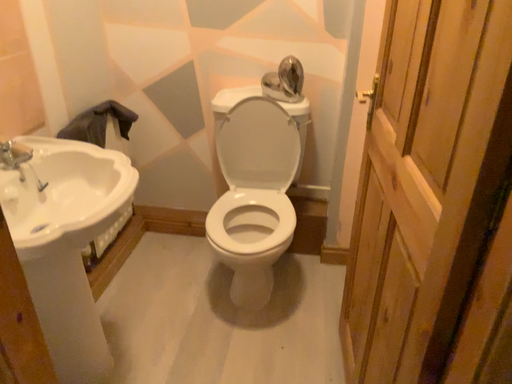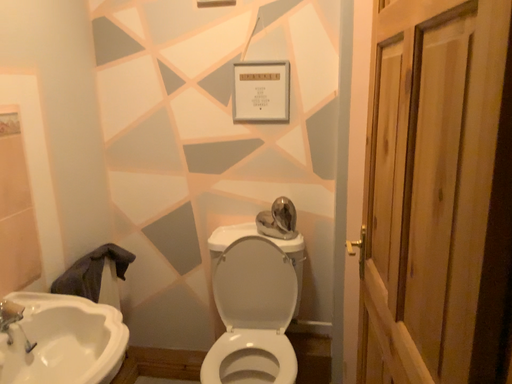
Question: Which way did the camera rotate in the video?

Choices:
 (A) rotated upward
 (B) rotated downward

Answer: (A)